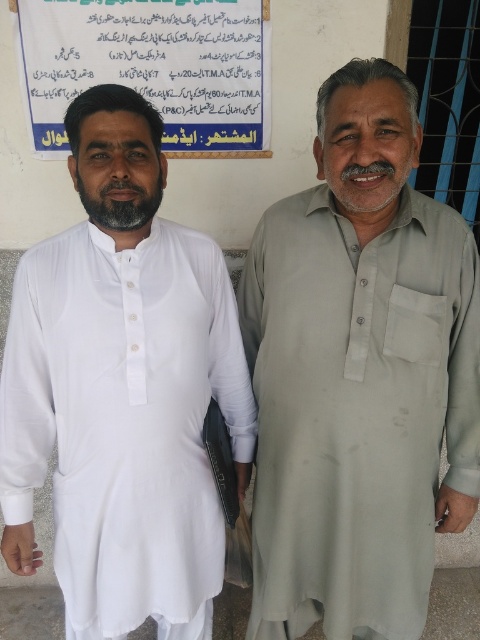
You are trying to decide which item is easier to fold neatly. Based on the image, which object would you choose between the light gray cotton shirt at right and the blue paper at upper center?

The light gray cotton shirt at right is thinner than the blue paper at upper center, so it would be easier to fold neatly.

You are standing at the point marked as point [276,458] in the image. You want to move 2 meters forward. Will you be able to do so without hitting any walls or obstacles?

The point [276,458] and viewer are 1.65 meters apart. Since you want to move 2 meters forward, but there is only 1.65 meters of space available, you will not be able to move the full 2 meters without hitting a wall or obstacle.